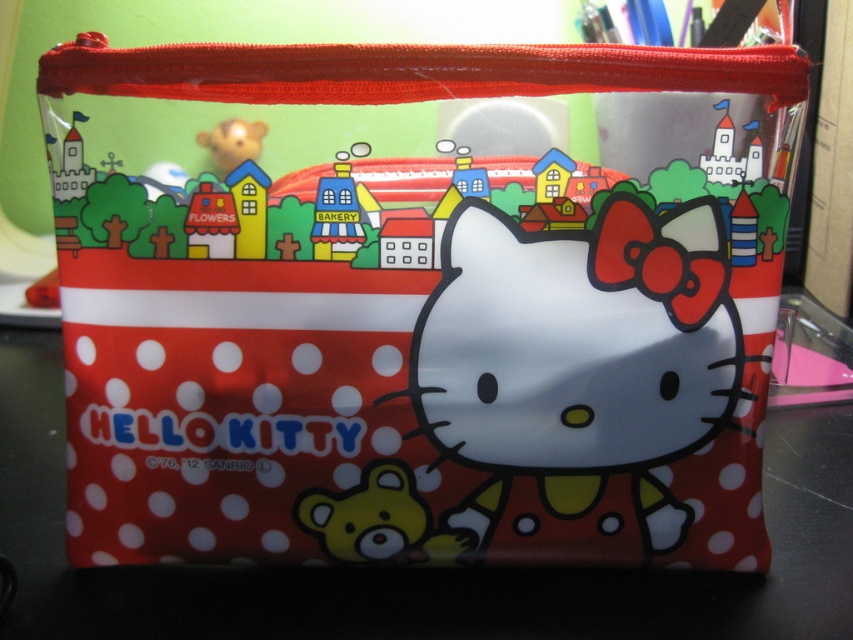
You are designing a shelf display for a toy store and want to arrange the yellow matte bear at center and the matte plastic bear at upper left. Which bear should you place higher on the shelf to match their sizes?

The yellow matte bear at center is taller than the matte plastic bear at upper left, so place the yellow matte bear at center higher on the shelf to reflect its larger size.

You are designing a sticker sheet for the Hello Kitty pouch. You have a sticker of the white glossy cat at center and a sticker of the matte plastic bear at upper left. Which sticker should you choose if you want the character to take up more space on the sticker sheet?

The white glossy cat at center should be chosen because its width is larger than the matte plastic bear at upper left, making it take up more space on the sticker sheet.